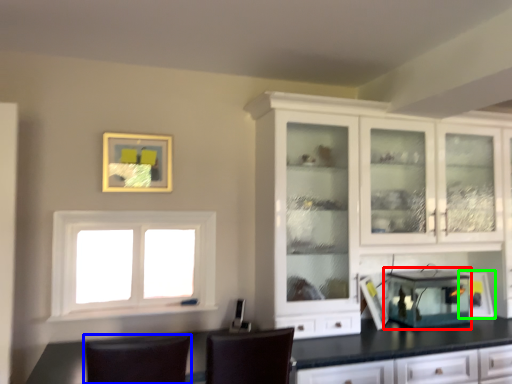
Question: Based on their relative distances, which object is farther from appliance (highlighted by a red box)? Choose from chair (highlighted by a blue box) and appliance (highlighted by a green box).

Choices:
 (A) chair
 (B) appliance

Answer: (A)